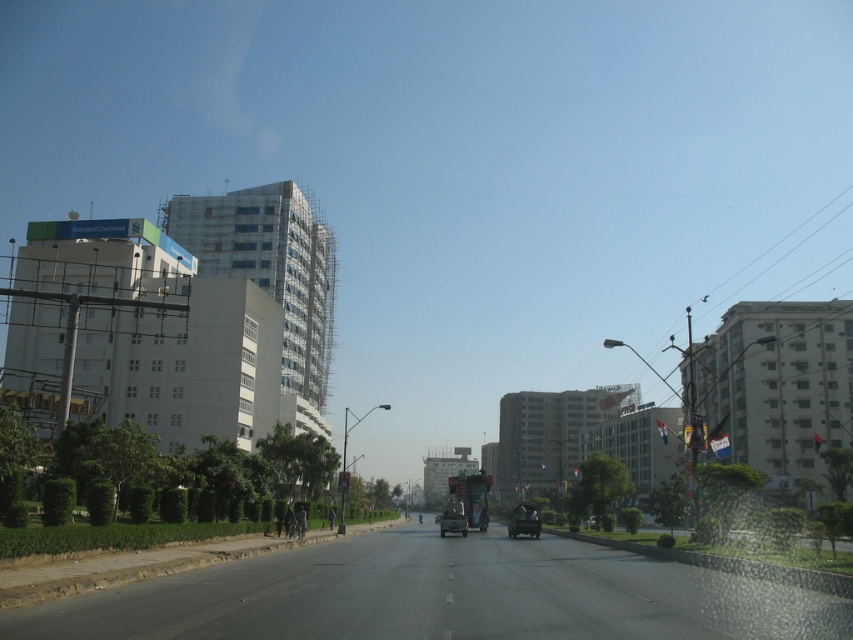
Question: Which of the following is the closest to the observer?

Choices:
 (A) (531, 531)
 (B) (439, 522)

Answer: (A)

Question: Is metallic silver car at center wider than metallic silver truck at center?

Choices:
 (A) yes
 (B) no

Answer: (A)

Question: Which point is closer to the camera taking this photo?

Choices:
 (A) (515, 524)
 (B) (456, 518)

Answer: (A)

Question: Is metallic silver car at center behind metallic silver truck at center?

Choices:
 (A) no
 (B) yes

Answer: (A)

Question: Which point is farther to the camera?

Choices:
 (A) metallic silver car at center
 (B) metallic silver truck at center

Answer: (B)

Question: Where is metallic silver car at center located in relation to metallic silver truck at center in the image?

Choices:
 (A) right
 (B) left

Answer: (A)